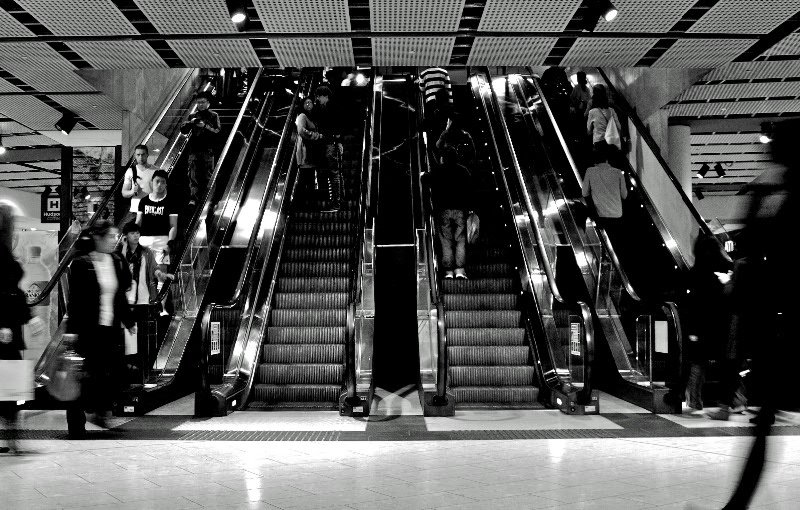
This screenshot has height=510, width=800. I want to click on light, so click(x=245, y=22).